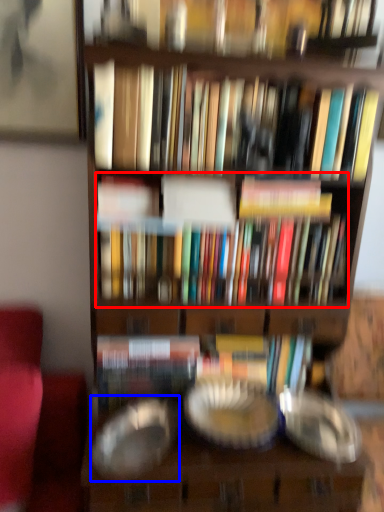
Question: Which object appears closest to the camera in this image, book (highlighted by a red box) or glass plate (highlighted by a blue box)?

Choices:
 (A) book
 (B) glass plate

Answer: (B)